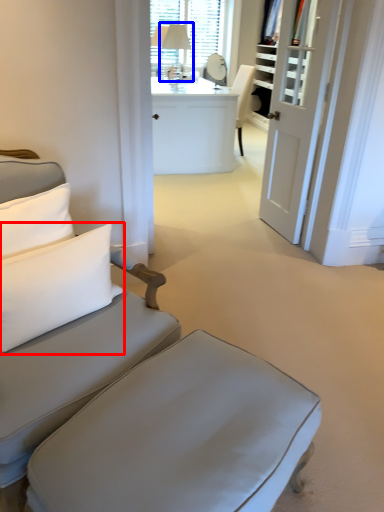
Question: Which object appears farthest to the camera in this image, pillow (highlighted by a red box) or table lamp (highlighted by a blue box)?

Choices:
 (A) pillow
 (B) table lamp

Answer: (B)